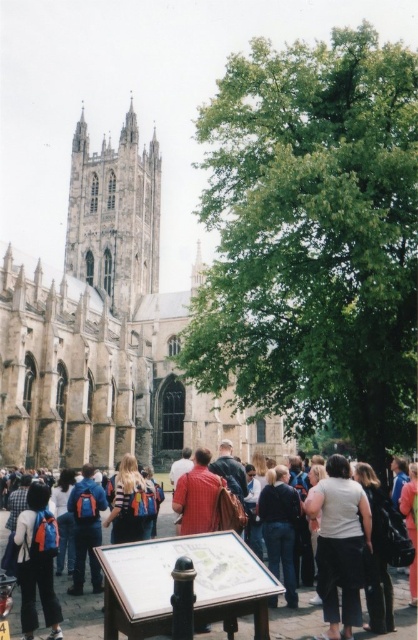
Question: Can you confirm if striped shirt backpack at center is bigger than orange backpack at center?

Choices:
 (A) yes
 (B) no

Answer: (A)

Question: Does white cotton shirt at center have a greater width compared to blue backpack at center?

Choices:
 (A) no
 (B) yes

Answer: (B)

Question: Which point is farther to the camera?

Choices:
 (A) (86, 616)
 (B) (285, 472)
 (C) (50, 584)
 (D) (132, 532)

Answer: (B)

Question: Which point is closer to the camera?

Choices:
 (A) white cotton shirt at center
 (B) blue backpack at center
 (C) dark blue jeans at lower right

Answer: (A)

Question: Which object is farther from the camera taking this photo?

Choices:
 (A) blue backpack at center
 (B) stone gothic cathedral at center

Answer: (B)

Question: Is blue backpack at center closer to camera compared to striped shirt backpack at center?

Choices:
 (A) yes
 (B) no

Answer: (A)